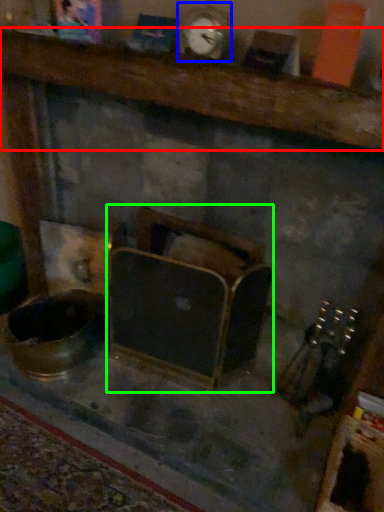
Question: Based on their relative distances, which object is farther from furniture (highlighted by a red box)? Choose from clock (highlighted by a blue box) and furniture (highlighted by a green box).

Choices:
 (A) clock
 (B) furniture

Answer: (B)